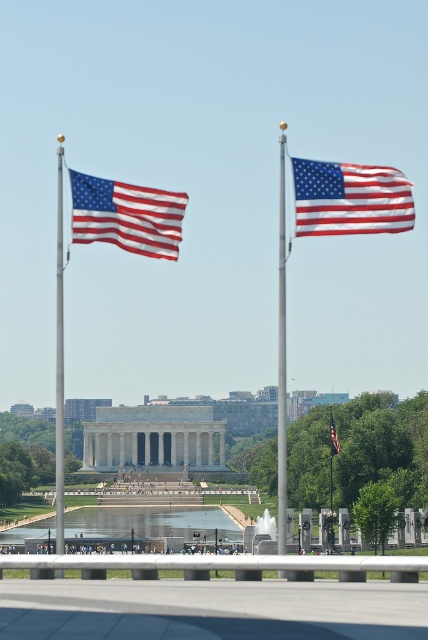
Who is more forward, (56, 509) or (338, 451)?

Point (338, 451) is more forward.

Does silver metallic flagpole at left have a greater width compared to matte fabric flag at center?

Yes.

Locate an element on the screen. silver metallic flagpole at left is located at coordinates (59, 362).

Does polished metal flagpole at center come in front of silver metallic flagpole at left?

Yes, polished metal flagpole at center is closer to the viewer.

Who is more forward, (284, 445) or (59, 424)?

Point (284, 445) is in front.

You are a GUI agent. You are given a task and a screenshot of the screen. Output one action in this format:
    pyautogui.click(x=<x>, y=<y>)
    Task: Click on the polished metal flagpole at center
    
    Given the screenshot: What is the action you would take?
    pyautogui.click(x=282, y=358)

Is point (318, 168) closer to camera compared to point (172, 221)?

That is True.

Is matte fabric flag at upper right bigger than matte fabric flag at left?

Indeed, matte fabric flag at upper right has a larger size compared to matte fabric flag at left.

Find the location of a particular element. The height and width of the screenshot is (640, 428). matte fabric flag at upper right is located at coordinates (350, 198).